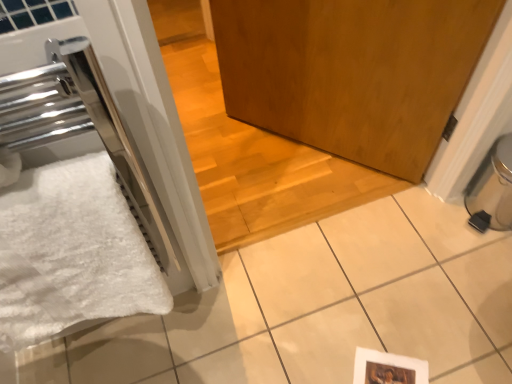
Question: Should I look upward or downward to see wooden door at center?

Choices:
 (A) down
 (B) up

Answer: (B)

Question: Would you say black plastic water heater at lower right is part of white fluffy bath towel at left's contents?

Choices:
 (A) no
 (B) yes

Answer: (A)

Question: Is white fluffy bath towel at left facing towards black plastic water heater at lower right?

Choices:
 (A) yes
 (B) no

Answer: (B)

Question: Is white fluffy bath towel at left positioned with its back to black plastic water heater at lower right?

Choices:
 (A) no
 (B) yes

Answer: (A)

Question: Does white fluffy bath towel at left appear on the right side of black plastic water heater at lower right?

Choices:
 (A) no
 (B) yes

Answer: (A)

Question: Does white fluffy bath towel at left have a greater height compared to black plastic water heater at lower right?

Choices:
 (A) yes
 (B) no

Answer: (A)

Question: Considering the relative sizes of white fluffy bath towel at left and black plastic water heater at lower right in the image provided, is white fluffy bath towel at left bigger than black plastic water heater at lower right?

Choices:
 (A) yes
 (B) no

Answer: (A)

Question: Does black plastic water heater at lower right turn towards wooden door at center?

Choices:
 (A) no
 (B) yes

Answer: (A)

Question: Does black plastic water heater at lower right have a greater height compared to wooden door at center?

Choices:
 (A) yes
 (B) no

Answer: (A)

Question: Is black plastic water heater at lower right with wooden door at center?

Choices:
 (A) no
 (B) yes

Answer: (A)

Question: Can you confirm if black plastic water heater at lower right is wider than wooden door at center?

Choices:
 (A) yes
 (B) no

Answer: (B)

Question: Does black plastic water heater at lower right appear on the left side of wooden door at center?

Choices:
 (A) yes
 (B) no

Answer: (B)

Question: Does black plastic water heater at lower right appear on the right side of wooden door at center?

Choices:
 (A) no
 (B) yes

Answer: (B)

Question: Considering the relative sizes of wooden door at center and black plastic water heater at lower right in the image provided, is wooden door at center smaller than black plastic water heater at lower right?

Choices:
 (A) no
 (B) yes

Answer: (A)